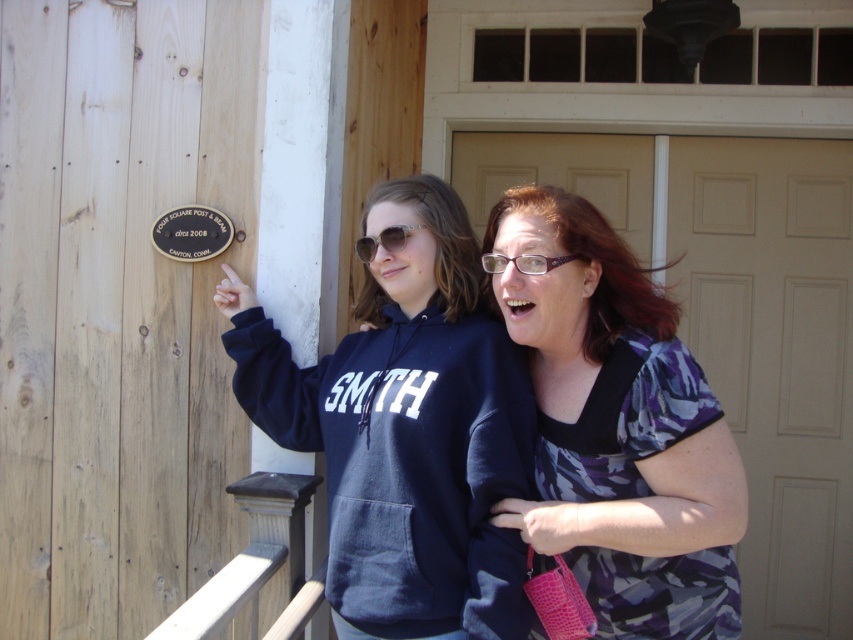
From the picture: You are a delivery person trying to enter the building through the white matte door at center. The clear plastic glasses at upper center have a note that says,

The white matte door at center is larger than the clear plastic glasses at upper center, so the delivery person can easily enter through the door without needing to use the glasses.

You are designing a new outfit and need to know the relative sizes of the navy blue hoodie at center and the wooden at lower left. Which object is wider?

The navy blue hoodie at center is wider than the wooden at lower left.

You are standing in front of the wooden structure and want to place a 15 inch wide decorative plaque between the navy blue hoodie at center and the wooden at lower left. Will there be enough space?

The navy blue hoodie at center is 14.67 inches away from wooden at lower left. Since the decorative plaque is 15 inches wide, there isn not enough space to place it between them.